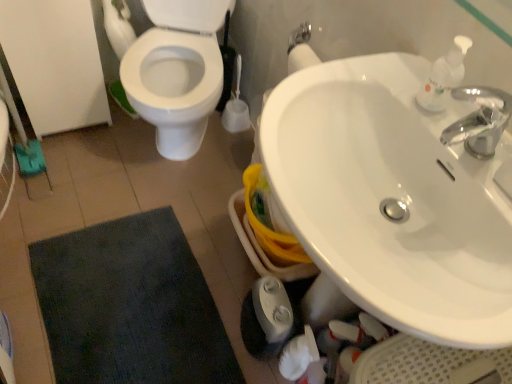
Measure the distance between white glossy sink at upper right and camera.

white glossy sink at upper right is 23.07 inches away from camera.

What do you see at coordinates (444, 76) in the screenshot? The width and height of the screenshot is (512, 384). I see `white plastic soap dispenser at upper right` at bounding box center [444, 76].

The image size is (512, 384). I want to click on white plastic soap dispenser at upper right, so click(x=444, y=76).

You are a GUI agent. You are given a task and a screenshot of the screen. Output one action in this format:
    pyautogui.click(x=<x>, y=<y>)
    Task: Click on the white glossy sink at upper right
    
    Given the screenshot: What is the action you would take?
    pyautogui.click(x=392, y=199)

Is white glossy sink at upper right next to white plastic soap dispenser at upper right and touching it?

white glossy sink at upper right is not next to white plastic soap dispenser at upper right, and they're not touching.

The height and width of the screenshot is (384, 512). Identify the location of soap dispenser lying above the white glossy sink at upper right (from the image's perspective). (444, 76).

Between white glossy sink at upper right and white plastic soap dispenser at upper right, which one has smaller width?

white plastic soap dispenser at upper right is thinner.

Consider the image. Could white plastic soap dispenser at upper right be considered to be inside white glossy sink at upper right?

No.

From a real-world perspective, does white glossy sink at upper right stand above dark blue textured bath mat at lower left?

Indeed, from a real-world perspective, white glossy sink at upper right stands above dark blue textured bath mat at lower left.

Does white glossy sink at upper right turn towards dark blue textured bath mat at lower left?

No, white glossy sink at upper right does not turn towards dark blue textured bath mat at lower left.

Is there a large distance between white glossy sink at upper right and dark blue textured bath mat at lower left?

No.

Find the location of a particular element. The height and width of the screenshot is (384, 512). sink above the dark blue textured bath mat at lower left (from a real-world perspective) is located at coordinates (392, 199).

Is white plastic soap dispenser at upper right facing away from dark blue textured bath mat at lower left?

No.

Considering the positions of objects white plastic soap dispenser at upper right and dark blue textured bath mat at lower left in the image provided, who is behind, white plastic soap dispenser at upper right or dark blue textured bath mat at lower left?

dark blue textured bath mat at lower left is more distant.

From the image's perspective, which is above, white plastic soap dispenser at upper right or dark blue textured bath mat at lower left?

white plastic soap dispenser at upper right, from the image's perspective.

Can you confirm if white plastic soap dispenser at upper right is positioned to the left of dark blue textured bath mat at lower left?

In fact, white plastic soap dispenser at upper right is to the right of dark blue textured bath mat at lower left.

Considering the relative positions of dark blue textured bath mat at lower left and white plastic soap dispenser at upper right in the image provided, is dark blue textured bath mat at lower left to the left of white plastic soap dispenser at upper right from the viewer's perspective?

Correct, you'll find dark blue textured bath mat at lower left to the left of white plastic soap dispenser at upper right.

Where is `bath mat behind the white plastic soap dispenser at upper right`? The height and width of the screenshot is (384, 512). bath mat behind the white plastic soap dispenser at upper right is located at coordinates (130, 306).

Based on the photo, which object is more forward, dark blue textured bath mat at lower left or white plastic soap dispenser at upper right?

white plastic soap dispenser at upper right is more forward.

Considering the points (127, 376) and (443, 58), which point is behind, point (127, 376) or point (443, 58)?

The point (127, 376) is farther from the camera.

Who is bigger, white plastic soap dispenser at upper right or white glossy sink at upper right?

With larger size is white glossy sink at upper right.

From the image's perspective, is white plastic soap dispenser at upper right under white glossy sink at upper right?

No, from the image's perspective, white plastic soap dispenser at upper right is not below white glossy sink at upper right.

At what (x,y) coordinates should I click in order to perform the action: click on soap dispenser above the white glossy sink at upper right (from the image's perspective). Please return your answer as a coordinate pair (x, y). This screenshot has width=512, height=384. Looking at the image, I should click on (444, 76).

From a real-world perspective, is white plastic soap dispenser at upper right located beneath white glossy sink at upper right?

No, from a real-world perspective, white plastic soap dispenser at upper right is not under white glossy sink at upper right.

Is dark blue textured bath mat at lower left outside of white glossy sink at upper right?

dark blue textured bath mat at lower left lies outside white glossy sink at upper right's area.

Which object is further away from the camera taking this photo, dark blue textured bath mat at lower left or white glossy sink at upper right?

dark blue textured bath mat at lower left is more distant.

Is white glossy sink at upper right at the back of dark blue textured bath mat at lower left?

No.

Does point (79, 295) come closer to viewer compared to point (369, 210)?

No, (79, 295) is behind (369, 210).

Identify the location of sink on the left of white plastic soap dispenser at upper right. (392, 199).

This screenshot has width=512, height=384. Find the location of `bath mat that appears below the white glossy sink at upper right (from a real-world perspective)`. bath mat that appears below the white glossy sink at upper right (from a real-world perspective) is located at coordinates (130, 306).

From the picture: Which object lies nearer to the anchor point white glossy sink at upper right, dark blue textured bath mat at lower left or white plastic soap dispenser at upper right?

white plastic soap dispenser at upper right is positioned closer to the anchor white glossy sink at upper right.

When comparing their distances from white plastic soap dispenser at upper right, does white glossy sink at upper right or dark blue textured bath mat at lower left seem closer?

Among the two, white glossy sink at upper right is located nearer to white plastic soap dispenser at upper right.

Considering their positions, is white glossy sink at upper right positioned closer to dark blue textured bath mat at lower left than white plastic soap dispenser at upper right?

white glossy sink at upper right lies closer to dark blue textured bath mat at lower left than the other object.

Which object lies further to the anchor point white plastic soap dispenser at upper right, dark blue textured bath mat at lower left or white glossy sink at upper right?

dark blue textured bath mat at lower left lies further to white plastic soap dispenser at upper right than the other object.

Which object lies further to the anchor point dark blue textured bath mat at lower left, white plastic soap dispenser at upper right or white glossy sink at upper right?

white plastic soap dispenser at upper right is further to dark blue textured bath mat at lower left.

When comparing their distances from white glossy sink at upper right, does white plastic soap dispenser at upper right or dark blue textured bath mat at lower left seem closer?

white plastic soap dispenser at upper right.

The image size is (512, 384). In order to click on sink between dark blue textured bath mat at lower left and white plastic soap dispenser at upper right in the horizontal direction in this screenshot , I will do (392, 199).